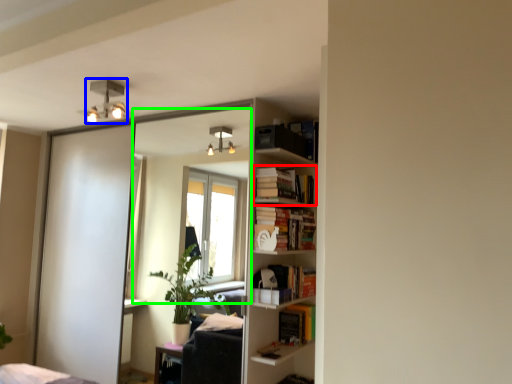
Question: Based on their relative distances, which object is farther from book (highlighted by a red box)? Choose from light fixture (highlighted by a blue box) and mirror (highlighted by a green box).

Choices:
 (A) light fixture
 (B) mirror

Answer: (B)